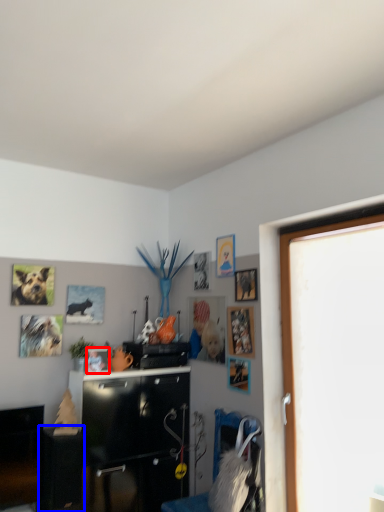
Question: Which object is further to the camera taking this photo, picture frame (highlighted by a red box) or table (highlighted by a blue box)?

Choices:
 (A) picture frame
 (B) table

Answer: (A)